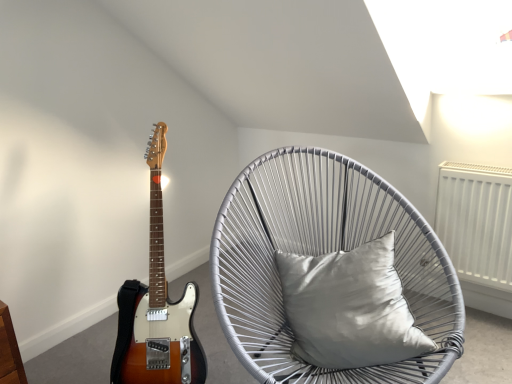
Question: Considering the positions of point (407, 314) and point (259, 289), is point (407, 314) closer or farther from the camera than point (259, 289)?

Choices:
 (A) farther
 (B) closer

Answer: (B)

Question: Is satin silver pillow at center taller or shorter than silver woven chair with cushion at center?

Choices:
 (A) short
 (B) tall

Answer: (A)

Question: Based on their relative distances, which object is nearer to the satin wood guitar at left?

Choices:
 (A) satin silver pillow at center
 (B) silver woven chair with cushion at center

Answer: (B)

Question: Which object is the farthest from the satin wood guitar at left?

Choices:
 (A) satin silver pillow at center
 (B) silver woven chair with cushion at center

Answer: (A)